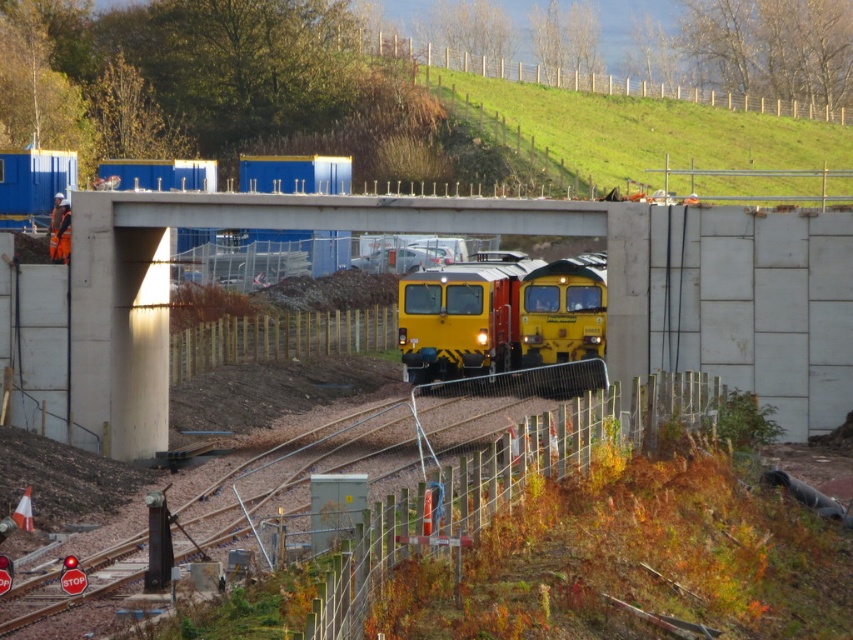
Question: Which object is the closest to the concrete at center?

Choices:
 (A) green grass at upper center
 (B) yellow matte train at center

Answer: (B)

Question: Can you confirm if concrete at center is bigger than green grass at upper center?

Choices:
 (A) yes
 (B) no

Answer: (B)

Question: Does green grass at upper center have a greater width compared to yellow matte train at center?

Choices:
 (A) yes
 (B) no

Answer: (A)

Question: Which point appears farthest from the camera in this image?

Choices:
 (A) (546, 145)
 (B) (722, 273)
 (C) (560, 348)

Answer: (A)

Question: Which of the following is the closest to the observer?

Choices:
 (A) yellow matte train at center
 (B) concrete at center

Answer: (B)

Question: Can you confirm if concrete at center is bigger than green grass at upper center?

Choices:
 (A) no
 (B) yes

Answer: (A)